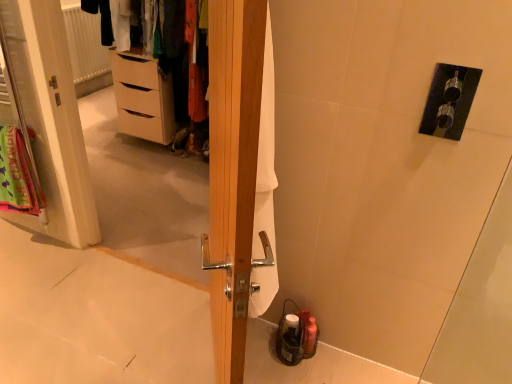
Question: Can you confirm if light brown wooden chest of drawers at left is positioned to the right of white fabric screen door at left?

Choices:
 (A) no
 (B) yes

Answer: (B)

Question: Is light brown wooden chest of drawers at left shorter than white fabric screen door at left?

Choices:
 (A) yes
 (B) no

Answer: (A)

Question: Would you say light brown wooden chest of drawers at left contains white fabric screen door at left?

Choices:
 (A) no
 (B) yes

Answer: (A)

Question: Can you confirm if light brown wooden chest of drawers at left is bigger than white fabric screen door at left?

Choices:
 (A) no
 (B) yes

Answer: (B)

Question: Can we say light brown wooden chest of drawers at left lies outside white fabric screen door at left?

Choices:
 (A) no
 (B) yes

Answer: (B)

Question: Is light brown wooden chest of drawers at left positioned with its back to white fabric screen door at left?

Choices:
 (A) yes
 (B) no

Answer: (B)

Question: Is neon green fabric at left aimed at wooden door at center?

Choices:
 (A) yes
 (B) no

Answer: (B)

Question: Is neon green fabric at left closer to the viewer compared to wooden door at center?

Choices:
 (A) no
 (B) yes

Answer: (A)

Question: From a real-world perspective, does neon green fabric at left stand above wooden door at center?

Choices:
 (A) yes
 (B) no

Answer: (B)

Question: From the image's perspective, is neon green fabric at left over wooden door at center?

Choices:
 (A) no
 (B) yes

Answer: (B)

Question: Is wooden door at center at the back of neon green fabric at left?

Choices:
 (A) no
 (B) yes

Answer: (A)

Question: Is neon green fabric at left smaller than wooden door at center?

Choices:
 (A) yes
 (B) no

Answer: (A)

Question: Would you say white fabric screen door at left is part of neon green fabric at left's contents?

Choices:
 (A) no
 (B) yes

Answer: (A)